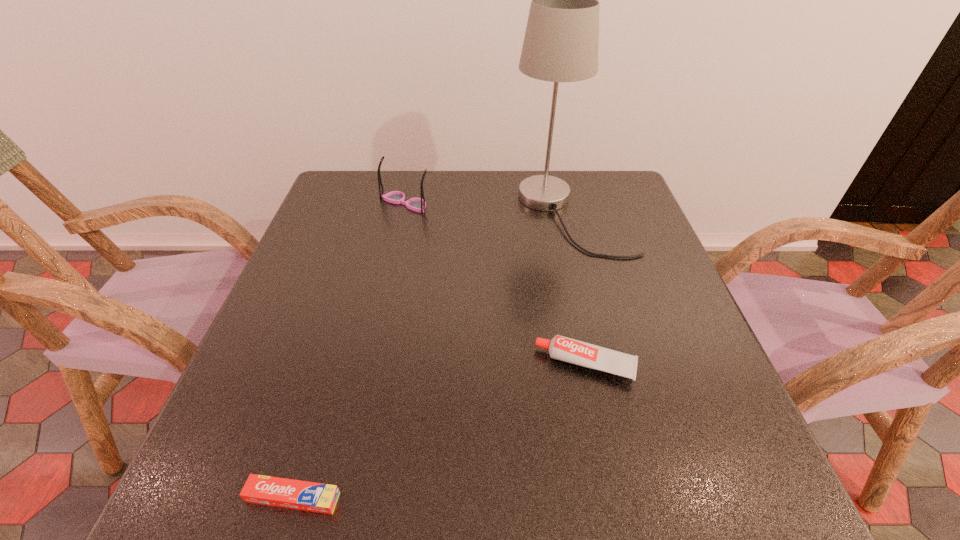
Find the location of a particular element. table lamp that is at the far edge is located at coordinates click(x=561, y=42).

The width and height of the screenshot is (960, 540). I want to click on spectacles at the far edge, so click(x=416, y=204).

The height and width of the screenshot is (540, 960). Identify the location of object situated at the near edge. (302, 495).

I want to click on spectacles that is positioned at the left edge, so click(x=416, y=204).

You are a GUI agent. You are given a task and a screenshot of the screen. Output one action in this format:
    pyautogui.click(x=<x>, y=<y>)
    Task: Click on the toothpaste at the left edge
    The width and height of the screenshot is (960, 540).
    Given the screenshot: What is the action you would take?
    302,495

Find the location of a particular element. table lamp at the right edge is located at coordinates (561, 42).

Where is `toothpaste that is at the right edge`? This screenshot has width=960, height=540. toothpaste that is at the right edge is located at coordinates (565, 349).

This screenshot has width=960, height=540. I want to click on object that is at the far left corner, so click(416, 204).

Where is `object located in the near left corner section of the desktop`? This screenshot has height=540, width=960. object located in the near left corner section of the desktop is located at coordinates (302, 495).

Identify the location of object positioned at the far right corner. (561, 42).